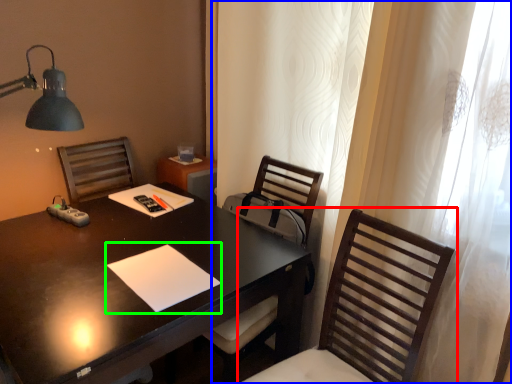
Question: Estimate the real-world distances between objects in this image. Which object is farther from chair (highlighted by a red box), curtain (highlighted by a blue box) or notepad (highlighted by a green box)?

Choices:
 (A) curtain
 (B) notepad

Answer: (B)